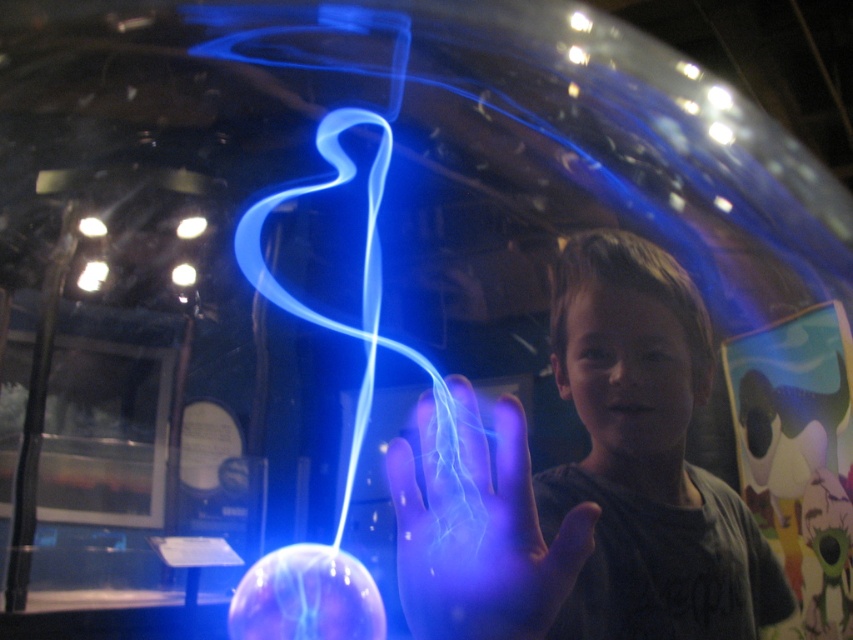
Is the position of matte black shirt at center more distant than that of translucent glass sphere at center?

No.

In the scene shown: Can you confirm if matte black shirt at center is wider than translucent glass sphere at center?

In fact, matte black shirt at center might be narrower than translucent glass sphere at center.

The image size is (853, 640). Identify the location of matte black shirt at center. (602, 483).

Does matte black shirt at center have a greater width compared to translucent blue hand at center?

Correct, the width of matte black shirt at center exceeds that of translucent blue hand at center.

Is matte black shirt at center taller than translucent blue hand at center?

Yes, matte black shirt at center is taller than translucent blue hand at center.

Which is in front, point (671, 456) or point (476, 592)?

Point (476, 592) is more forward.

Find the location of `matte black shirt at center`. matte black shirt at center is located at coordinates (602, 483).

Does translucent blue hand at center have a greater height compared to translucent glass sphere at center?

Incorrect, translucent blue hand at center's height is not larger of translucent glass sphere at center's.

Between translucent blue hand at center and translucent glass sphere at center, which one has less height?

translucent blue hand at center is shorter.

You are a GUI agent. You are given a task and a screenshot of the screen. Output one action in this format:
    pyautogui.click(x=<x>, y=<y>)
    Task: Click on the translucent blue hand at center
    Image resolution: width=853 pixels, height=640 pixels.
    Given the screenshot: What is the action you would take?
    pyautogui.click(x=479, y=529)